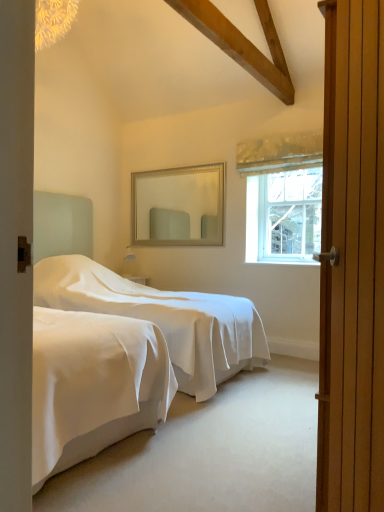
Question: Does point (180, 179) appear closer or farther from the camera than point (296, 224)?

Choices:
 (A) farther
 (B) closer

Answer: (A)

Question: From a real-world perspective, is silver/golden frame mirror at upper center physically located above or below clear glass window at upper right?

Choices:
 (A) below
 (B) above

Answer: (B)

Question: Estimate the real-world distances between objects in this image. Which object is farther from the white smooth bed at center?

Choices:
 (A) clear glass window at upper right
 (B) silver/golden frame mirror at upper center
 (C) wooden door at right

Answer: (C)

Question: Estimate the real-world distances between objects in this image. Which object is closer to the white smooth bed at center?

Choices:
 (A) silver/golden frame mirror at upper center
 (B) wooden door at right
 (C) clear glass window at upper right

Answer: (A)